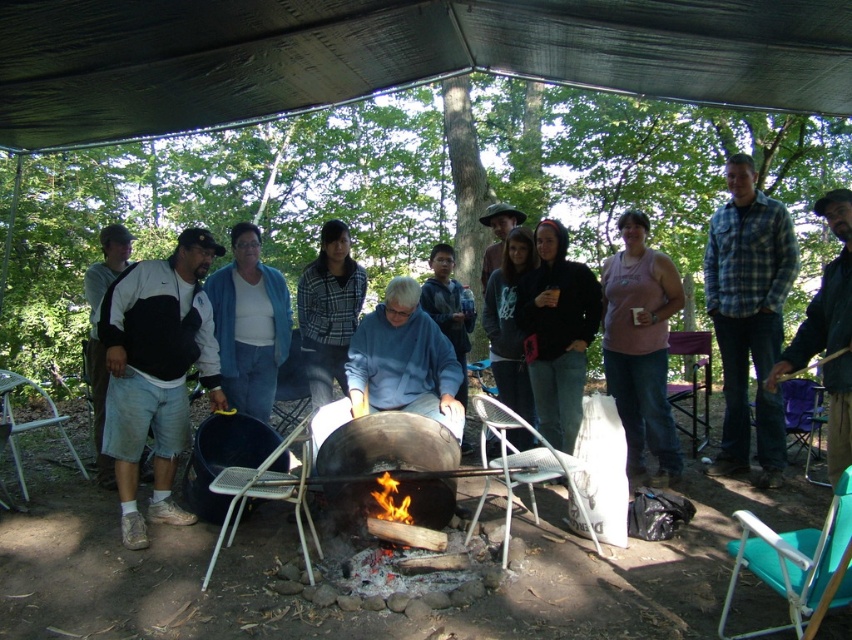
You are standing at the center of the image and want to walk directly towards the charcoal black fire pit at center. What direction should you head?

Since the charcoal black fire pit at center is located at coordinates point (378, 458), you should head towards the lower right direction from the center of the image to reach it.

From the picture: You are a photographer at the campsite. You want to take a photo of the blue denim jacket at center and the flamewood at center so that both are clearly visible. Given their sizes, which object should you focus on to ensure the smaller one is in focus?

The flamewood at center is smaller than the blue denim jacket at center, so you should focus on the flamewood at center to ensure it is in focus while the larger jacket remains visible.

You are a photographer at the campsite. You want to take a photo of the blue denim jacket at center and the flamewood at center so that both are clearly visible. Given their sizes, which object should you focus on to ensure both are in frame without cropping?

The blue denim jacket at center is much taller than the flamewood at center, so focusing on the taller blue denim jacket at center would ensure both are in frame without cropping.